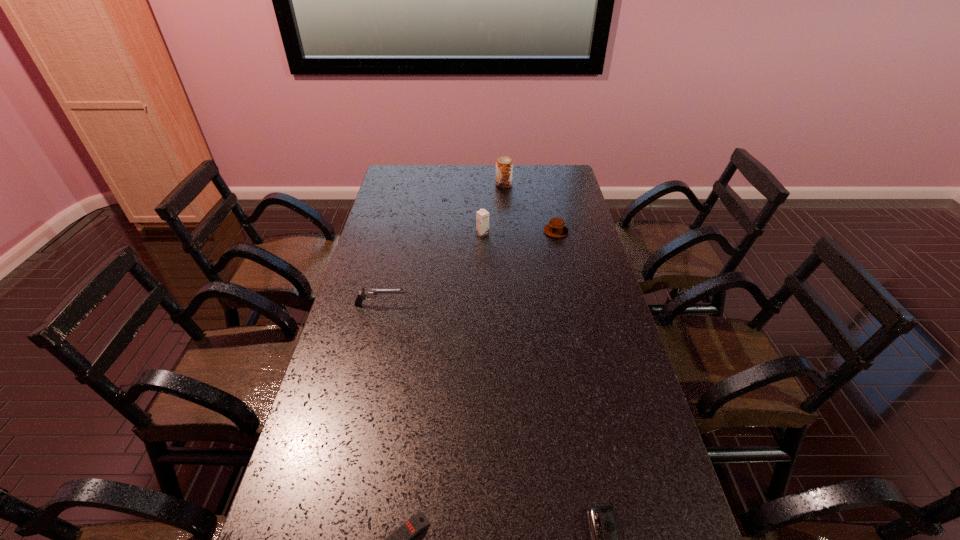
At what (x,y) coordinates should I click in order to perform the action: click on the fourth object from left to right. Please return your answer as a coordinate pair (x, y). This screenshot has height=540, width=960. Looking at the image, I should click on (504, 166).

Where is `beer can`? This screenshot has width=960, height=540. beer can is located at coordinates (504, 166).

This screenshot has width=960, height=540. Identify the location of the second tallest object. (482, 216).

This screenshot has width=960, height=540. Find the location of `the third object from left to right`. the third object from left to right is located at coordinates (482, 216).

The height and width of the screenshot is (540, 960). What are the coordinates of `the fourth farthest object` in the screenshot? It's located at (365, 293).

Identify the location of the fourth shortest object. This screenshot has height=540, width=960. (365, 293).

Locate an element on the screen. Image resolution: width=960 pixels, height=540 pixels. the fourth tallest object is located at coordinates (555, 228).

Find the location of `vacant space located 0.370m on the left of the farthest object`. vacant space located 0.370m on the left of the farthest object is located at coordinates (416, 185).

This screenshot has height=540, width=960. I want to click on vacant space situated 0.060m on the right of the chocolate milk, so click(504, 234).

I want to click on free space located on the front-facing side of the fourth shortest object, so click(x=436, y=305).